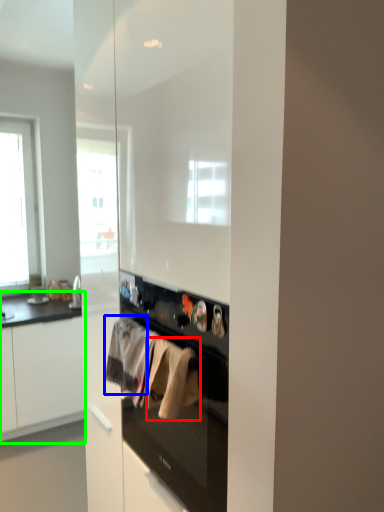
Question: Which object is positioned closest to clothing (highlighted by a red box)? Select from clothing (highlighted by a blue box) and cabinetry (highlighted by a green box).

Choices:
 (A) clothing
 (B) cabinetry

Answer: (A)